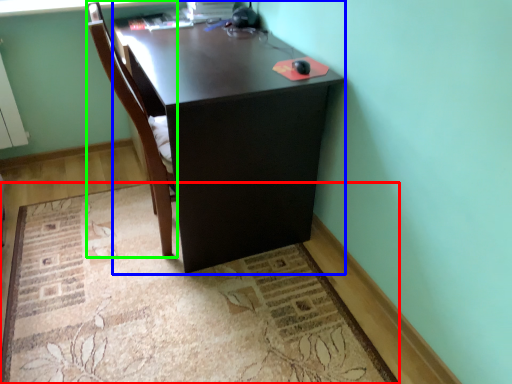
Question: Based on their relative distances, which object is farther from mat (highlighted by a red box)? Choose from desk (highlighted by a blue box) and chair (highlighted by a green box).

Choices:
 (A) desk
 (B) chair

Answer: (B)